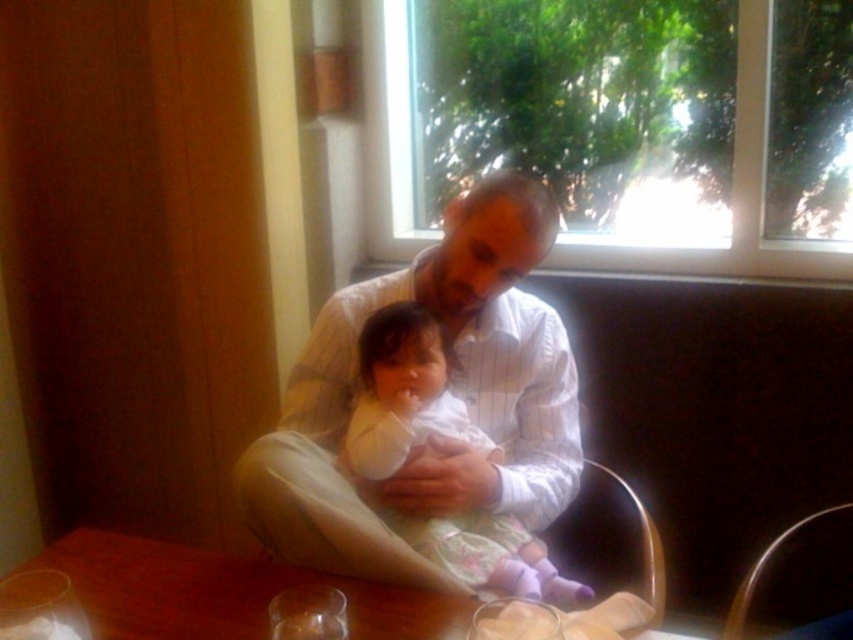
Question: Which object appears closest to the camera in this image?

Choices:
 (A) white soft fabric baby at center
 (B) white striped shirt at center
 (C) brown wooden table at center

Answer: (C)

Question: Is white soft fabric baby at center bigger than brown wooden table at center?

Choices:
 (A) yes
 (B) no

Answer: (A)

Question: Can you confirm if white soft fabric baby at center is positioned above brown wooden table at center?

Choices:
 (A) yes
 (B) no

Answer: (A)

Question: Can you confirm if white soft fabric baby at center is bigger than brown wooden table at center?

Choices:
 (A) yes
 (B) no

Answer: (A)

Question: Which point is farther from the camera taking this photo?

Choices:
 (A) (248, 632)
 (B) (403, 365)

Answer: (B)

Question: Which of the following is the farthest from the observer?

Choices:
 (A) (347, 584)
 (B) (415, 349)

Answer: (B)